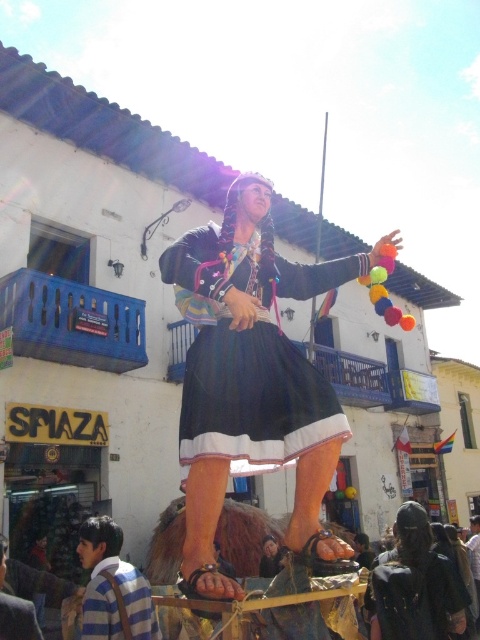
Question: Can you confirm if matte black dress at center is positioned below striped shirt at lower left?

Choices:
 (A) yes
 (B) no

Answer: (A)

Question: Which of the following is the farthest from the observer?

Choices:
 (A) black satin dress at center
 (B) striped shirt at lower left
 (C) striped cotton shirt at lower left

Answer: (C)

Question: Which object is the closest to the striped shirt at lower left?

Choices:
 (A) matte black dress at center
 (B) black satin dress at center
 (C) striped cotton shirt at lower left

Answer: (C)

Question: From the image, what is the correct spatial relationship of black satin dress at center in relation to striped shirt at lower left?

Choices:
 (A) right
 (B) left

Answer: (A)

Question: In this image, where is black satin dress at center located relative to striped cotton shirt at lower left?

Choices:
 (A) left
 (B) right

Answer: (B)

Question: Among these objects, which one is nearest to the camera?

Choices:
 (A) striped cotton shirt at lower left
 (B) black satin dress at center
 (C) striped shirt at lower left
 (D) matte black dress at center

Answer: (C)